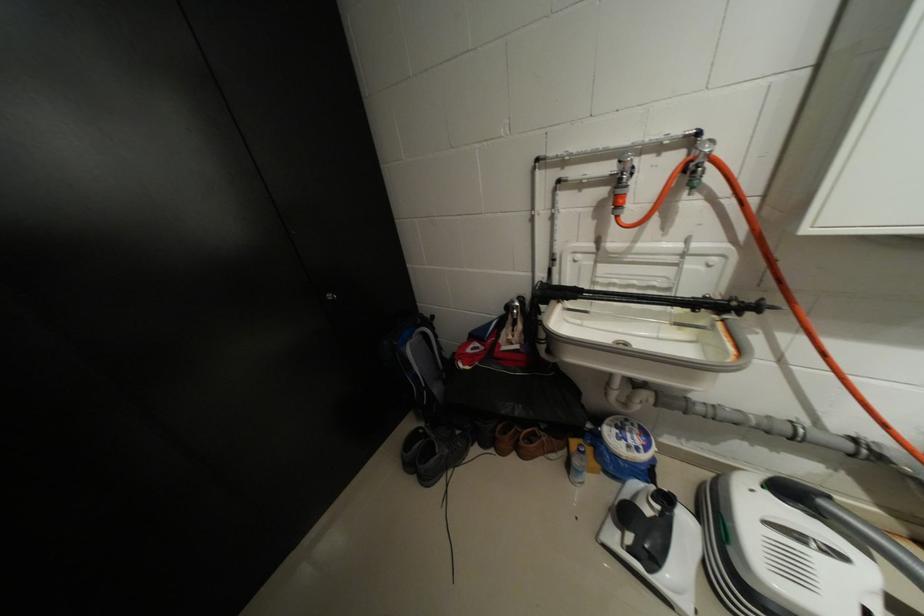
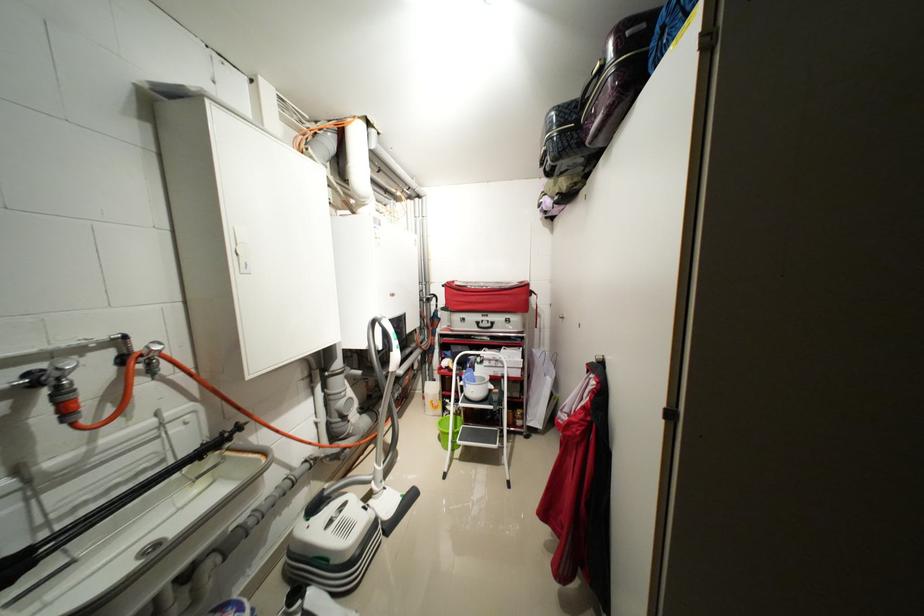
Find the pixel in the second image that matches the point at 626,192 in the first image.

(71, 399)